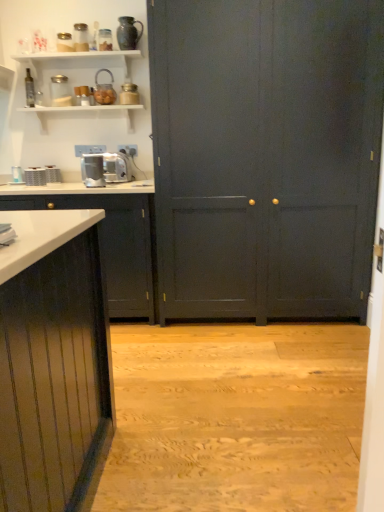
Question: Does clear glass jar at upper left, which ranks as the fourth appliance in left-to-right order, appear on the left side of brushed metal toaster at left, which is the sixth appliance in right-to-left order?

Choices:
 (A) yes
 (B) no

Answer: (B)

Question: Does clear glass jar at upper left, which ranks as the fourth appliance in left-to-right order, appear on the right side of brushed metal toaster at left, positioned as the second appliance in left-to-right order?

Choices:
 (A) yes
 (B) no

Answer: (A)

Question: Can brushed metal toaster at left, which is the sixth appliance in right-to-left order, be found inside clear glass jar at upper left, which ranks as the fourth appliance in left-to-right order?

Choices:
 (A) no
 (B) yes

Answer: (A)

Question: Can we say clear glass jar at upper left, which ranks as the fourth appliance in left-to-right order, lies outside brushed metal toaster at left, positioned as the second appliance in left-to-right order?

Choices:
 (A) yes
 (B) no

Answer: (A)

Question: Is clear glass jar at upper left, which ranks as the fourth appliance in left-to-right order, facing away from brushed metal toaster at left, positioned as the second appliance in left-to-right order?

Choices:
 (A) yes
 (B) no

Answer: (B)

Question: In terms of width, does metallic silver toaster at left, which ranks as the 3th appliance in left-to-right order, look wider or thinner when compared to metallic silver toaster at upper center, which is counted as the seventh appliance, starting from the left?

Choices:
 (A) thin
 (B) wide

Answer: (B)

Question: Is point (52, 164) closer or farther from the camera than point (130, 82)?

Choices:
 (A) closer
 (B) farther

Answer: (B)

Question: From a real-world perspective, is metallic silver toaster at left, arranged as the 5th appliance when viewed from the right, above or below metallic silver toaster at upper center, which ranks as the 1th appliance in right-to-left order?

Choices:
 (A) above
 (B) below

Answer: (B)

Question: Considering their positions, is metallic silver toaster at left, arranged as the 5th appliance when viewed from the right, located in front of or behind metallic silver toaster at upper center, which ranks as the 1th appliance in right-to-left order?

Choices:
 (A) front
 (B) behind

Answer: (B)

Question: Is brushed metal toaster at left, the 7th appliance when ordered from right to left, taller or shorter than metallic silver toaster at left, which ranks as the 3th appliance in left-to-right order?

Choices:
 (A) short
 (B) tall

Answer: (A)

Question: Considering the relative positions of brushed metal toaster at left, the 1th appliance in the left-to-right sequence, and metallic silver toaster at left, arranged as the 5th appliance when viewed from the right, in the image provided, is brushed metal toaster at left, the 1th appliance in the left-to-right sequence, to the left or to the right of metallic silver toaster at left, arranged as the 5th appliance when viewed from the right,?

Choices:
 (A) right
 (B) left

Answer: (B)

Question: From a real-world perspective, is brushed metal toaster at left, the 1th appliance in the left-to-right sequence, above or below metallic silver toaster at left, which ranks as the 3th appliance in left-to-right order?

Choices:
 (A) above
 (B) below

Answer: (A)

Question: Is point (18, 181) closer or farther from the camera than point (54, 166)?

Choices:
 (A) closer
 (B) farther

Answer: (A)

Question: Is clear glass jar at upper left, the 4th appliance from the right, in front of or behind matte glass teapot at upper center, which appears as the third appliance when viewed from the right, in the image?

Choices:
 (A) front
 (B) behind

Answer: (B)

Question: Is point (56, 89) closer or farther from the camera than point (112, 74)?

Choices:
 (A) closer
 (B) farther

Answer: (B)